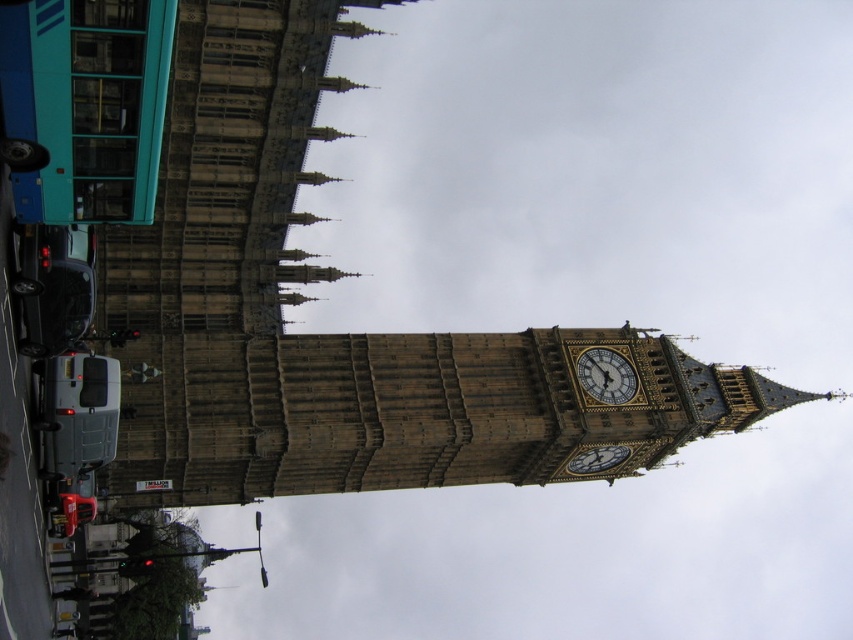
Looking at this image, between polished brass clock at center and gold ornate clock at center, which one is positioned higher?

polished brass clock at center

Can you confirm if polished brass clock at center is smaller than gold ornate clock at center?

Yes.

This screenshot has height=640, width=853. What do you see at coordinates (606, 376) in the screenshot?
I see `polished brass clock at center` at bounding box center [606, 376].

Image resolution: width=853 pixels, height=640 pixels. I want to click on polished brass clock at center, so point(606,376).